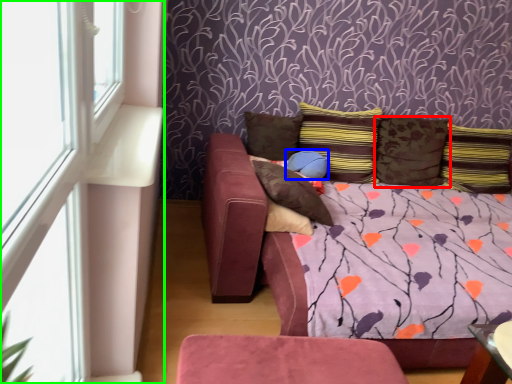
Question: Based on their relative distances, which object is nearer to pillow (highlighted by a red box)? Choose from pillow (highlighted by a blue box) and window frame (highlighted by a green box).

Choices:
 (A) pillow
 (B) window frame

Answer: (A)